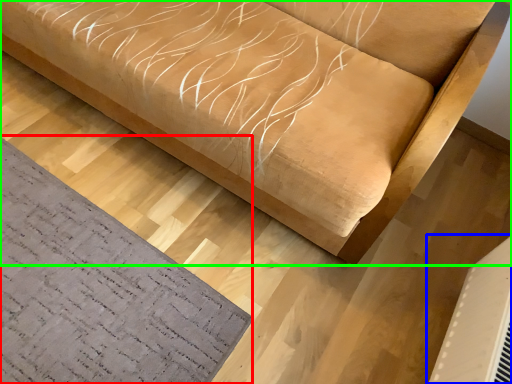
Question: Estimate the real-world distances between objects in this image. Which object is farther from mat (highlighted by a red box), air conditioning (highlighted by a blue box) or furniture (highlighted by a green box)?

Choices:
 (A) air conditioning
 (B) furniture

Answer: (A)